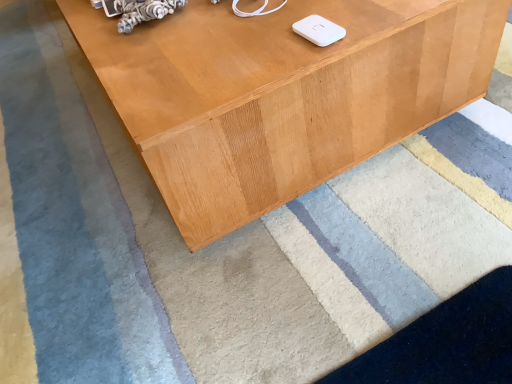
What is the approximate width of white matte ipod at upper center?

white matte ipod at upper center is 3.11 inches in width.

What do you see at coordinates (318, 30) in the screenshot?
I see `white matte ipod at upper center` at bounding box center [318, 30].

Where is `white matte ipod at upper center`? Image resolution: width=512 pixels, height=384 pixels. white matte ipod at upper center is located at coordinates (318, 30).

Describe the element at coordinates (281, 94) in the screenshot. I see `light brown wood table at center` at that location.

Locate an element on the screen. This screenshot has height=384, width=512. light brown wood table at center is located at coordinates (281, 94).

Locate an element on the screen. white matte ipod at upper center is located at coordinates (318, 30).

Between white matte ipod at upper center and light brown wood table at center, which one appears on the right side from the viewer's perspective?

white matte ipod at upper center is more to the right.

Considering the positions of objects white matte ipod at upper center and light brown wood table at center in the image provided, who is behind, white matte ipod at upper center or light brown wood table at center?

white matte ipod at upper center is further away from the camera.

Which is behind, point (320, 24) or point (396, 71)?

The point (396, 71) is more distant.

From the image's perspective, does white matte ipod at upper center appear lower than light brown wood table at center?

Yes.

From a real-world perspective, which is physically below, white matte ipod at upper center or light brown wood table at center?

light brown wood table at center.

Does white matte ipod at upper center have a greater width compared to light brown wood table at center?

In fact, white matte ipod at upper center might be narrower than light brown wood table at center.

From their relative heights in the image, would you say white matte ipod at upper center is taller or shorter than light brown wood table at center?

Clearly, white matte ipod at upper center is shorter compared to light brown wood table at center.

Between white matte ipod at upper center and light brown wood table at center, which one has smaller size?

Smaller between the two is white matte ipod at upper center.

Which is correct: white matte ipod at upper center is inside light brown wood table at center, or outside of it?

white matte ipod at upper center is not enclosed by light brown wood table at center.

Is white matte ipod at upper center positioned far away from light brown wood table at center?

Actually, white matte ipod at upper center and light brown wood table at center are a little close together.

Does white matte ipod at upper center turn towards light brown wood table at center?

No, white matte ipod at upper center is not oriented towards light brown wood table at center.

How different are the orientations of white matte ipod at upper center and light brown wood table at center in degrees?

The angular difference between white matte ipod at upper center and light brown wood table at center is 4.65 degrees.

Locate an element on the screen. table located underneath the white matte ipod at upper center (from a real-world perspective) is located at coordinates (281, 94).

Would you say light brown wood table at center is to the left or to the right of white matte ipod at upper center in the picture?

light brown wood table at center is to the left of white matte ipod at upper center.

Which is behind, light brown wood table at center or white matte ipod at upper center?

white matte ipod at upper center is further from the camera.

Between point (383, 5) and point (335, 40), which one is positioned behind?

Point (383, 5)

From the image's perspective, is light brown wood table at center positioned above or below white matte ipod at upper center?

light brown wood table at center is situated higher than white matte ipod at upper center in the image.

From a real-world perspective, does light brown wood table at center stand above white matte ipod at upper center?

Actually, light brown wood table at center is physically below white matte ipod at upper center in the real world.

Looking at their sizes, would you say light brown wood table at center is wider or thinner than white matte ipod at upper center?

Clearly, light brown wood table at center has more width compared to white matte ipod at upper center.

Which of these two, light brown wood table at center or white matte ipod at upper center, stands taller?

light brown wood table at center is taller.

Is light brown wood table at center smaller than white matte ipod at upper center?

No.

Could white matte ipod at upper center be considered to be inside light brown wood table at center?

Actually, white matte ipod at upper center is outside light brown wood table at center.

Are light brown wood table at center and white matte ipod at upper center far apart?

No.

Is light brown wood table at center positioned with its back to white matte ipod at upper center?

No, light brown wood table at center is not facing the opposite direction of white matte ipod at upper center.

I want to click on ipod lying behind the light brown wood table at center, so click(318, 30).

You are a GUI agent. You are given a task and a screenshot of the screen. Output one action in this format:
    pyautogui.click(x=<x>, y=<y>)
    Task: Click on the ipod that is on the right side of light brown wood table at center
    The height and width of the screenshot is (384, 512).
    Given the screenshot: What is the action you would take?
    pyautogui.click(x=318, y=30)

At what (x,y) coordinates should I click in order to perform the action: click on ipod behind the light brown wood table at center. Please return your answer as a coordinate pair (x, y). Looking at the image, I should click on (318, 30).